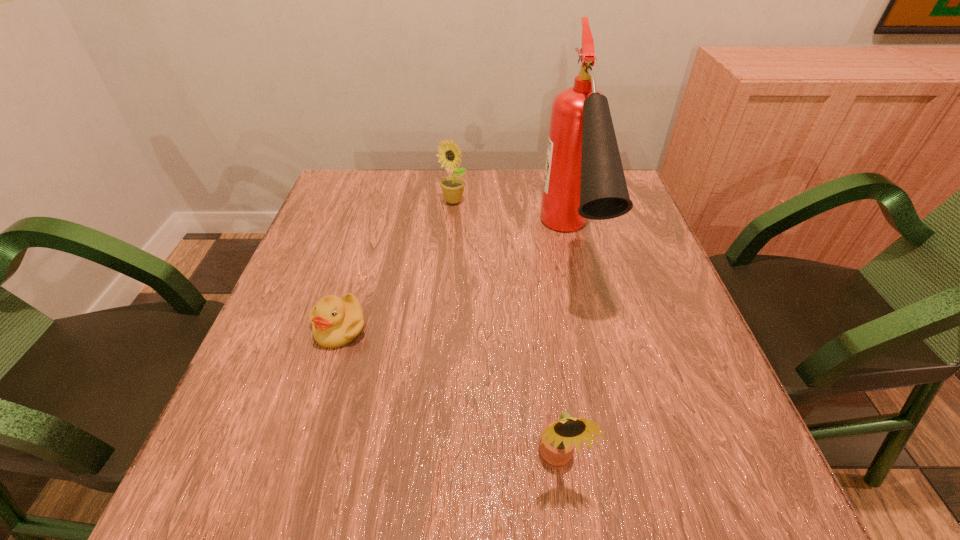
I want to click on the tallest object, so click(584, 179).

Image resolution: width=960 pixels, height=540 pixels. I want to click on the left sunflower, so click(453, 186).

Locate an element on the screen. The height and width of the screenshot is (540, 960). the farther sunflower is located at coordinates (453, 186).

This screenshot has height=540, width=960. Find the location of `the nearer sunflower`. the nearer sunflower is located at coordinates (558, 439).

Identify the location of the nearest object. The image size is (960, 540). (558, 439).

You are a GUI agent. You are given a task and a screenshot of the screen. Output one action in this format:
    pyautogui.click(x=<x>, y=<y>)
    Task: Click on the leftmost object
    This screenshot has height=540, width=960.
    Given the screenshot: What is the action you would take?
    pyautogui.click(x=335, y=321)

Where is `the shortest object`? The height and width of the screenshot is (540, 960). the shortest object is located at coordinates (335, 321).

At what (x,y) coordinates should I click in order to perform the action: click on vacant region located 0.110m at the nozzle of the fire extinguisher. Please return your answer as a coordinate pair (x, y). Looking at the image, I should click on (595, 357).

Where is `vacant space situated 0.070m on the face of the left sunflower`? The height and width of the screenshot is (540, 960). vacant space situated 0.070m on the face of the left sunflower is located at coordinates (451, 224).

I want to click on vacant space located 0.050m on the face of the nearer sunflower, so click(x=564, y=521).